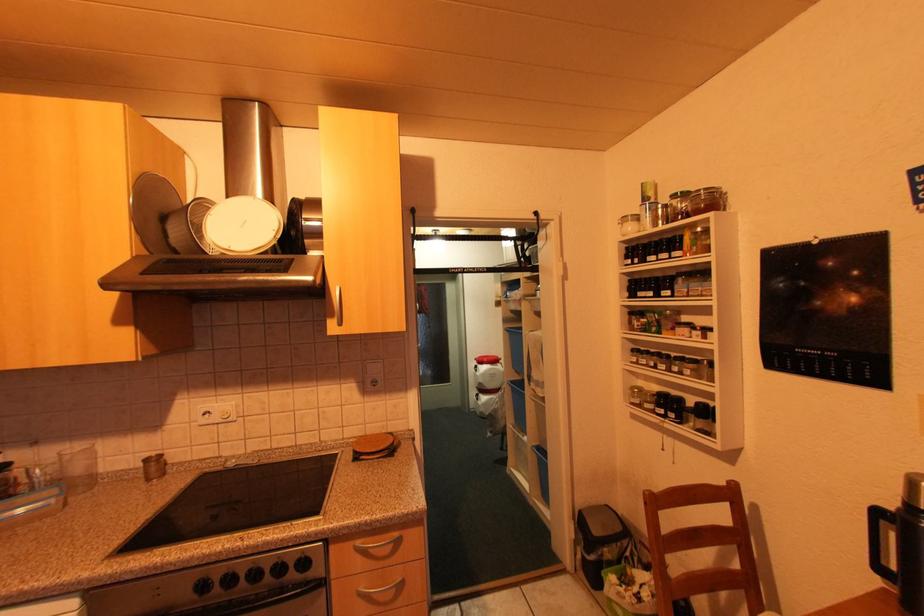
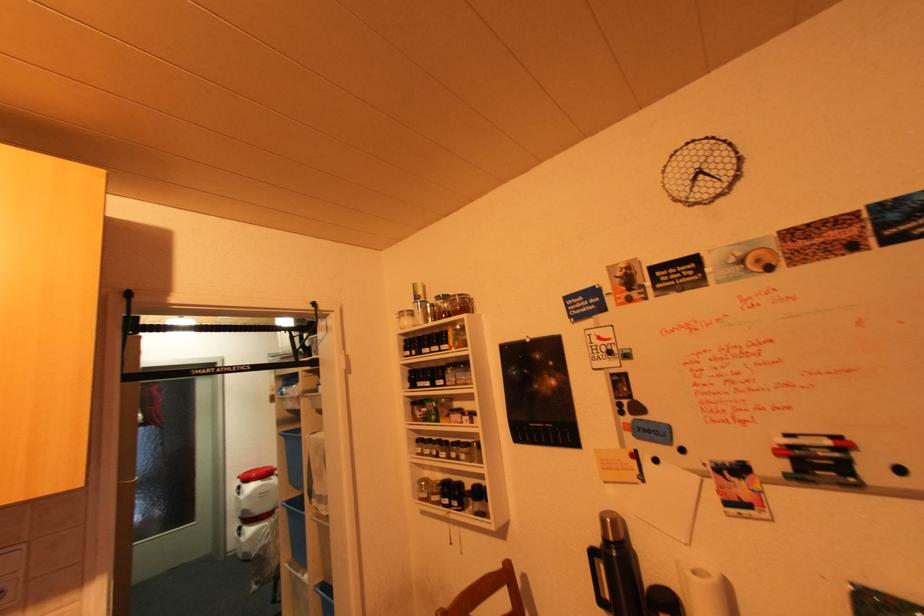
Question: Based on the continuous images, in which direction is the camera rotating? Reply with the corresponding letter.

Choices:
 (A) Left
 (B) Right
 (C) Up
 (D) Down

Answer: (B)